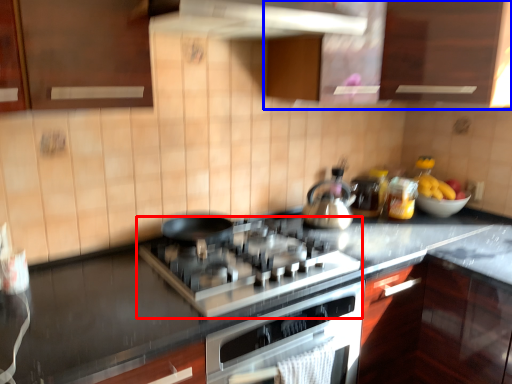
Question: Which object is further to the camera taking this photo, gas stove (highlighted by a red box) or cabinetry (highlighted by a blue box)?

Choices:
 (A) gas stove
 (B) cabinetry

Answer: (B)